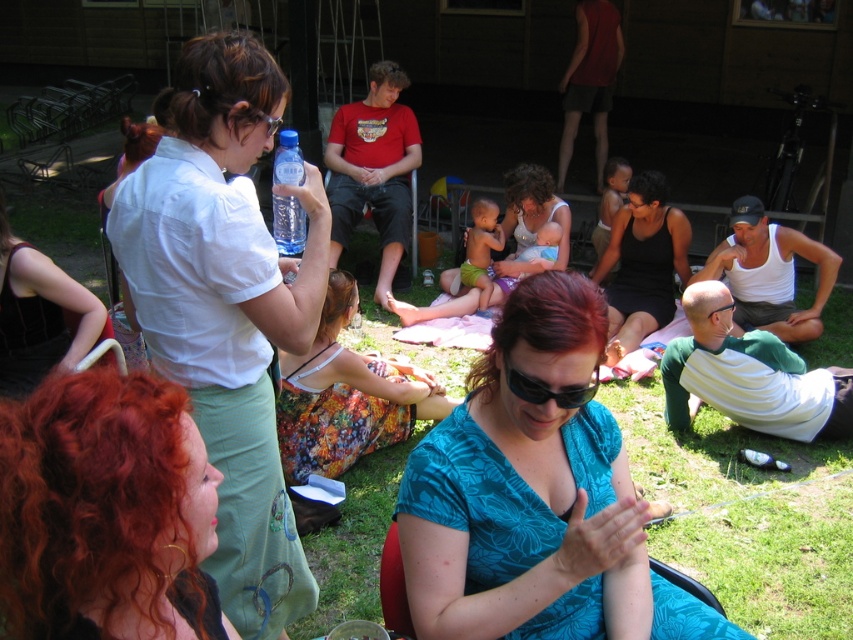
Question: In this image, where is teal floral dress at center located relative to white cotton shirt at upper left?

Choices:
 (A) right
 (B) left

Answer: (A)

Question: Which object is positioned closest to the transparent plastic bottle at upper center?

Choices:
 (A) white cotton shirt at upper left
 (B) black plastic goggles at center
 (C) matte white tank top at center

Answer: (A)

Question: Among these objects, which one is farthest from the camera?

Choices:
 (A) transparent plastic bottle at upper center
 (B) matte black tank top at center

Answer: (B)

Question: Can you confirm if black fabric dress at center is positioned to the left of black plastic goggles at center?

Choices:
 (A) no
 (B) yes

Answer: (B)

Question: Is transparent plastic bottle at upper center above black plastic sunglasses at center?

Choices:
 (A) no
 (B) yes

Answer: (B)

Question: Which object appears closest to the camera in this image?

Choices:
 (A) black plastic sunglasses at center
 (B) teal floral dress at center

Answer: (B)